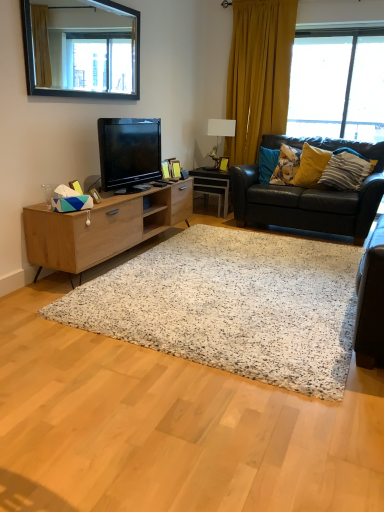
Question: Could you tell me if yellow fabric pillow at right, the second pillow positioned from the left, is facing black framed mirror at upper left?

Choices:
 (A) yes
 (B) no

Answer: (B)

Question: Is yellow fabric pillow at right, the 2th pillow positioned from the right, facing away from black framed mirror at upper left?

Choices:
 (A) yes
 (B) no

Answer: (B)

Question: Is yellow fabric pillow at right, the 2th pillow positioned from the right, to the left of black framed mirror at upper left from the viewer's perspective?

Choices:
 (A) no
 (B) yes

Answer: (A)

Question: From a real-world perspective, is yellow fabric pillow at right, the 2th pillow positioned from the right, under black framed mirror at upper left?

Choices:
 (A) no
 (B) yes

Answer: (B)

Question: Can you confirm if yellow fabric pillow at right, the 2th pillow positioned from the right, is taller than black framed mirror at upper left?

Choices:
 (A) no
 (B) yes

Answer: (A)

Question: Considering the relative sizes of yellow fabric pillow at right, the 2th pillow positioned from the right, and black framed mirror at upper left in the image provided, is yellow fabric pillow at right, the 2th pillow positioned from the right, shorter than black framed mirror at upper left?

Choices:
 (A) yes
 (B) no

Answer: (A)

Question: Is yellow fabric pillow at right, the second pillow positioned from the left, at the back of black framed mirror at upper left?

Choices:
 (A) no
 (B) yes

Answer: (A)

Question: Considering the relative sizes of black framed mirror at upper left and yellow fabric pillow at right, the second pillow positioned from the left, in the image provided, is black framed mirror at upper left bigger than yellow fabric pillow at right, the second pillow positioned from the left,?

Choices:
 (A) yes
 (B) no

Answer: (A)

Question: Is black framed mirror at upper left wider than yellow fabric pillow at right, the 2th pillow positioned from the right?

Choices:
 (A) no
 (B) yes

Answer: (A)

Question: Considering the relative sizes of black framed mirror at upper left and yellow fabric pillow at right, the 2th pillow positioned from the right, in the image provided, is black framed mirror at upper left shorter than yellow fabric pillow at right, the 2th pillow positioned from the right,?

Choices:
 (A) no
 (B) yes

Answer: (A)

Question: Considering the relative positions of black framed mirror at upper left and yellow fabric pillow at right, the second pillow positioned from the left, in the image provided, is black framed mirror at upper left to the left of yellow fabric pillow at right, the second pillow positioned from the left, from the viewer's perspective?

Choices:
 (A) yes
 (B) no

Answer: (A)

Question: Is black framed mirror at upper left positioned far away from yellow fabric pillow at right, the 2th pillow positioned from the right?

Choices:
 (A) yes
 (B) no

Answer: (A)

Question: Is black leather couch at right at the back of white ceramic lamp at upper center?

Choices:
 (A) no
 (B) yes

Answer: (A)